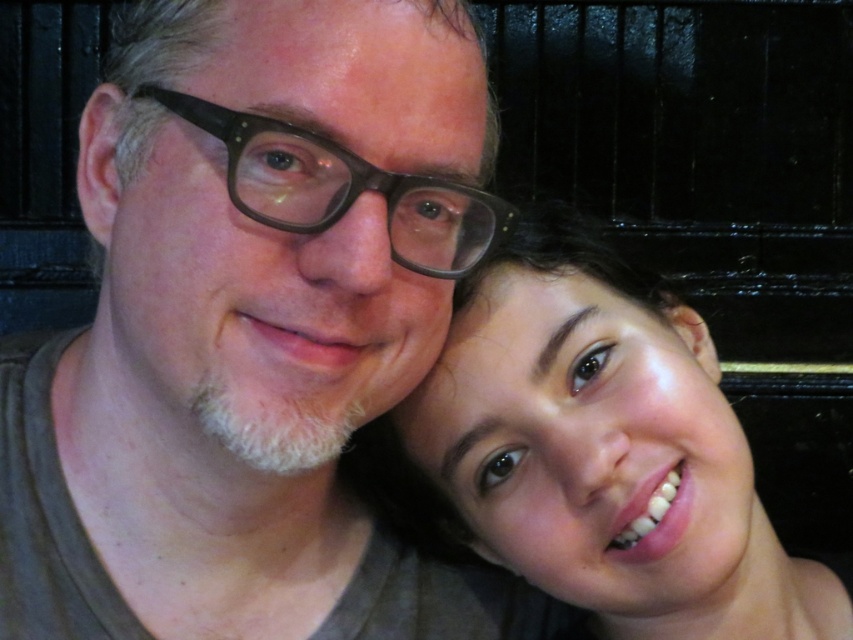
Can you confirm if smooth skin face at center is wider than matte brown glasses at center?

Yes, smooth skin face at center is wider than matte brown glasses at center.

Does smooth skin face at center have a greater height compared to matte brown glasses at center?

Indeed, smooth skin face at center has a greater height compared to matte brown glasses at center.

Does point (537, 308) lie in front of point (235, 177)?

No, it is not.

At what (x,y) coordinates should I click in order to perform the action: click on smooth skin face at center. Please return your answer as a coordinate pair (x, y). Looking at the image, I should click on (602, 451).

Who is taller, matte brown hair at center or smooth skin face at center?

Standing taller between the two is matte brown hair at center.

Is matte brown hair at center smaller than smooth skin face at center?

No, matte brown hair at center is not smaller than smooth skin face at center.

Find the location of a particular element. The width and height of the screenshot is (853, 640). matte brown hair at center is located at coordinates (252, 332).

Locate an element on the screen. matte brown hair at center is located at coordinates (252, 332).

Can you confirm if matte brown hair at center is taller than matte brown glasses at center?

Yes, matte brown hair at center is taller than matte brown glasses at center.

Locate an element on the screen. matte brown hair at center is located at coordinates (252, 332).

Does point (18, 342) come closer to viewer compared to point (351, 196)?

No.

Locate an element on the screen. matte brown hair at center is located at coordinates (252, 332).